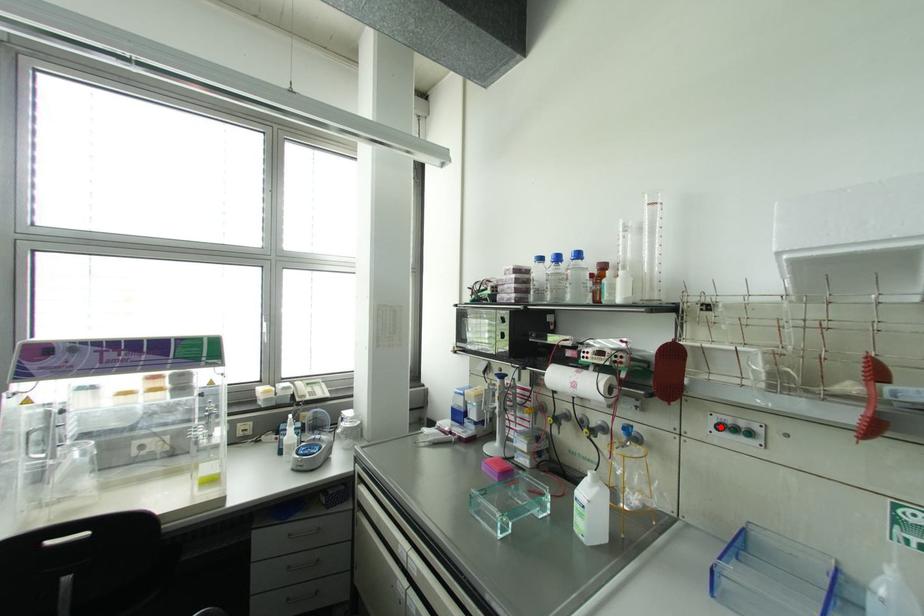
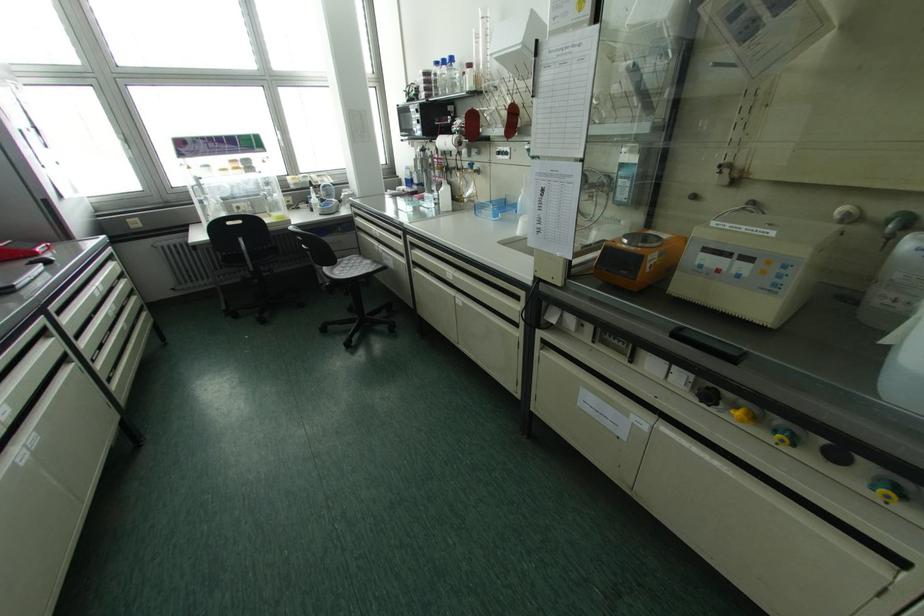
The point at the highlighted location is marked in the first image. Where is the corresponding point in the second image?

(497, 153)